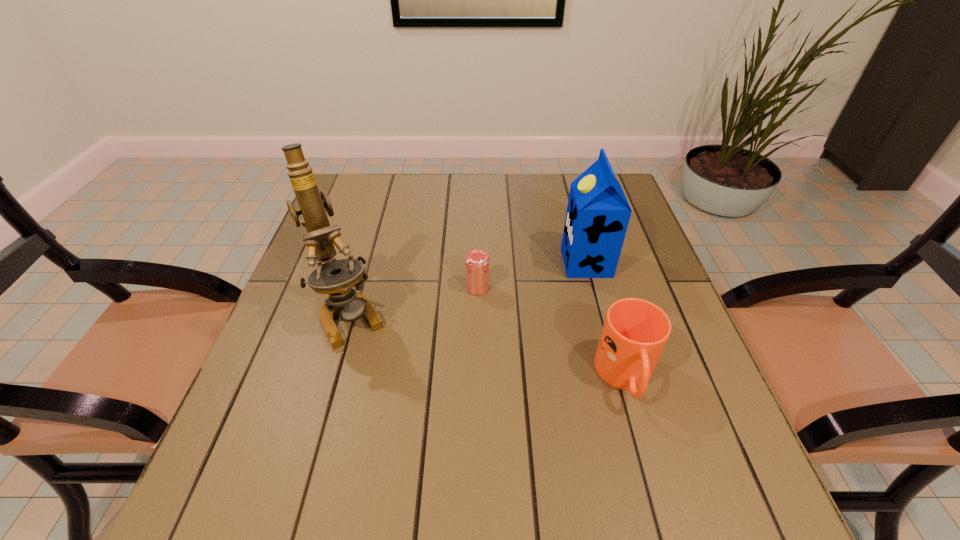
At what (x,y) coordinates should I click in order to perform the action: click on free space located with the cap open on the second tallest object. Please return your answer as a coordinate pair (x, y). Looking at the image, I should click on (491, 262).

Identify the location of vacant space located 0.080m on the handle side of the third tallest object. The image size is (960, 540). (648, 457).

Image resolution: width=960 pixels, height=540 pixels. In order to click on vacant area situated on the right of the shortest object in this screenshot , I will do `click(534, 288)`.

At what (x,y) coordinates should I click in order to perform the action: click on object that is at the left edge. Please return your answer as a coordinate pair (x, y). Looking at the image, I should click on (335, 277).

The width and height of the screenshot is (960, 540). Find the location of `carton located in the right edge section of the desktop`. carton located in the right edge section of the desktop is located at coordinates (598, 213).

Locate an element on the screen. mug that is at the right edge is located at coordinates (635, 331).

The height and width of the screenshot is (540, 960). In order to click on free space at the far edge of the desktop in this screenshot , I will do `click(490, 212)`.

Where is `free space at the left edge`? The height and width of the screenshot is (540, 960). free space at the left edge is located at coordinates (369, 221).

In the image, there is a desktop. Where is `vacant space at the right edge`? vacant space at the right edge is located at coordinates (660, 379).

What are the coordinates of `vacant space at the far left corner` in the screenshot? It's located at (374, 200).